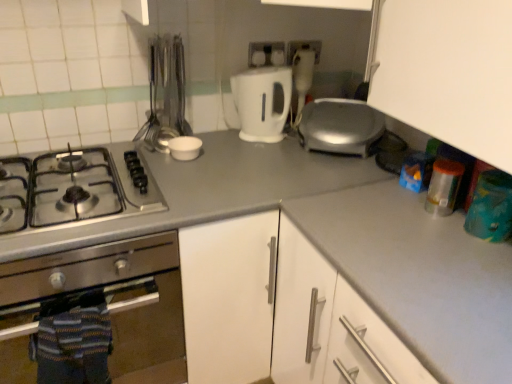
What do you see at coordinates (266, 54) in the screenshot? I see `white plastic electric outlet at upper center, the 1th electric outlet from the left` at bounding box center [266, 54].

You are a GUI agent. You are given a task and a screenshot of the screen. Output one action in this format:
    pyautogui.click(x=<x>, y=<y>)
    Task: Click on the white plastic electric outlet at upper center, which is counted as the second electric outlet, starting from the left
    The height and width of the screenshot is (384, 512).
    Given the screenshot: What is the action you would take?
    pyautogui.click(x=304, y=49)

The width and height of the screenshot is (512, 384). In order to click on stainless steel gas stove at left in this screenshot , I will do `click(87, 188)`.

This screenshot has width=512, height=384. Describe the element at coordinates (419, 276) in the screenshot. I see `white matte counter top at center` at that location.

Measure the distance between white glossy electric kettle at center, acting as the 2th kitchen appliance starting from the bottom, and camera.

white glossy electric kettle at center, acting as the 2th kitchen appliance starting from the bottom, and camera are 4.94 feet apart.

Measure the distance between stainless steel oven at left, which is counted as the second kitchen appliance, starting from the right, and camera.

stainless steel oven at left, which is counted as the second kitchen appliance, starting from the right, is 39.00 inches from camera.

In order to click on stainless steel oven at left, which ranks as the 1th kitchen appliance in bottom-to-top order in this screenshot , I will do `click(94, 314)`.

Locate an element on the screen. white matte bowl at center is located at coordinates point(185,147).

Is white plastic electric outlet at upper center, positioned as the second electric outlet in right-to-left order, far from stainless steel oven at left, marked as the first kitchen appliance in a left-to-right arrangement?

No.

Is white plastic electric outlet at upper center, positioned as the second electric outlet in right-to-left order, not within stainless steel oven at left, which is counted as the second kitchen appliance, starting from the right?

Absolutely, white plastic electric outlet at upper center, positioned as the second electric outlet in right-to-left order, is external to stainless steel oven at left, which is counted as the second kitchen appliance, starting from the right.

Which object is further away from the camera taking this photo, white plastic electric outlet at upper center, positioned as the second electric outlet in right-to-left order, or stainless steel oven at left, marked as the first kitchen appliance in a left-to-right arrangement?

white plastic electric outlet at upper center, positioned as the second electric outlet in right-to-left order, is more distant.

What's the angular difference between white plastic electric outlet at upper center, positioned as the second electric outlet in right-to-left order, and stainless steel oven at left, marked as the first kitchen appliance in a left-to-right arrangement,'s facing directions?

white plastic electric outlet at upper center, positioned as the second electric outlet in right-to-left order, and stainless steel oven at left, marked as the first kitchen appliance in a left-to-right arrangement, are facing 2.35 degrees away from each other.

Who is smaller, white plastic electric outlet at upper center, the 1th electric outlet positioned from the right, or white matte bowl at center?

white plastic electric outlet at upper center, the 1th electric outlet positioned from the right.

The height and width of the screenshot is (384, 512). I want to click on electric outlet that is the 2nd one when counting upward from the white matte bowl at center (from the image's perspective), so click(304, 49).

Which object is closer to the camera, white plastic electric outlet at upper center, the 1th electric outlet positioned from the right, or white matte bowl at center?

white matte bowl at center is in front.

Can you tell me how much white plastic electric outlet at upper center, which is counted as the second electric outlet, starting from the left, and white matte bowl at center differ in facing direction?

The angular difference between white plastic electric outlet at upper center, which is counted as the second electric outlet, starting from the left, and white matte bowl at center is 0.144 degrees.

Considering the relative positions of white matte bowl at center and white plastic electric outlet at upper center, the 1th electric outlet from the left, in the image provided, is white matte bowl at center in front of white plastic electric outlet at upper center, the 1th electric outlet from the left,?

Yes, white matte bowl at center is closer to the camera.

Can you see white matte bowl at center touching white plastic electric outlet at upper center, positioned as the second electric outlet in right-to-left order?

No, white matte bowl at center is not beside white plastic electric outlet at upper center, positioned as the second electric outlet in right-to-left order.

Which is closer to the camera, (194, 144) or (268, 46)?

Point (194, 144) is positioned closer to the camera compared to point (268, 46).

From the picture: Which of these two, white matte counter top at center or white glossy electric kettle at center, acting as the 1th kitchen appliance starting from the top, is smaller?

Smaller between the two is white glossy electric kettle at center, acting as the 1th kitchen appliance starting from the top.

From the image's perspective, would you say white matte counter top at center is shown under white glossy electric kettle at center, which is the first kitchen appliance in right-to-left order?

Yes, from the image's perspective, white matte counter top at center is below white glossy electric kettle at center, which is the first kitchen appliance in right-to-left order.

Which object is further away from the camera, white matte counter top at center or white glossy electric kettle at center, which is the first kitchen appliance in right-to-left order?

white glossy electric kettle at center, which is the first kitchen appliance in right-to-left order, is behind.

Is white glossy electric kettle at center, acting as the 2th kitchen appliance starting from the bottom, completely or partially inside gray matte countertop at center?

No, white glossy electric kettle at center, acting as the 2th kitchen appliance starting from the bottom, is not a part of gray matte countertop at center.

Which of these two, gray matte countertop at center or white glossy electric kettle at center, acting as the 1th kitchen appliance starting from the top, is thinner?

white glossy electric kettle at center, acting as the 1th kitchen appliance starting from the top.

Considering the relative sizes of gray matte countertop at center and white glossy electric kettle at center, acting as the 1th kitchen appliance starting from the top, in the image provided, is gray matte countertop at center shorter than white glossy electric kettle at center, acting as the 1th kitchen appliance starting from the top,?

In fact, gray matte countertop at center may be taller than white glossy electric kettle at center, acting as the 1th kitchen appliance starting from the top.

From a real-world perspective, is white matte bowl at center above or below stainless steel gas stove at left?

white matte bowl at center is situated higher than stainless steel gas stove at left in the real world.

Considering the points (179, 148) and (146, 211), which point is behind, point (179, 148) or point (146, 211)?

The point (179, 148) is more distant.

Does white matte bowl at center appear on the left side of stainless steel gas stove at left?

No, white matte bowl at center is not to the left of stainless steel gas stove at left.

Choose the correct answer: Is white matte bowl at center inside stainless steel gas stove at left or outside it?

white matte bowl at center is outside stainless steel gas stove at left.

From a real-world perspective, is stainless steel gas stove at left under stainless steel oven at left, which is counted as the second kitchen appliance, starting from the right?

No, from a real-world perspective, stainless steel gas stove at left is not below stainless steel oven at left, which is counted as the second kitchen appliance, starting from the right.

What's the angular difference between stainless steel gas stove at left and stainless steel oven at left, marked as the first kitchen appliance in a left-to-right arrangement,'s facing directions?

stainless steel gas stove at left and stainless steel oven at left, marked as the first kitchen appliance in a left-to-right arrangement, are facing 0.225 degrees away from each other.

Between stainless steel gas stove at left and stainless steel oven at left, which ranks as the 1th kitchen appliance in bottom-to-top order, which one has less height?

With less height is stainless steel gas stove at left.

Considering the relative positions of stainless steel gas stove at left and stainless steel oven at left, which ranks as the 1th kitchen appliance in bottom-to-top order, in the image provided, is stainless steel gas stove at left to the left or to the right of stainless steel oven at left, which ranks as the 1th kitchen appliance in bottom-to-top order,?

stainless steel gas stove at left is positioned on stainless steel oven at left, which ranks as the 1th kitchen appliance in bottom-to-top order,'s right side.

From the image's perspective, count 1st electric outlets upward from the stainless steel oven at left, marked as the first kitchen appliance in a left-to-right arrangement, and point to it. Please provide its 2D coordinates.

[(266, 54)]

The image size is (512, 384). In order to click on appliance in front of the white plastic electric outlet at upper center, the 1th electric outlet positioned from the right in this screenshot , I will do `click(185, 147)`.

When comparing their distances from white matte bowl at center, does metallic utensils at upper left or white plastic electric outlet at upper center, the 1th electric outlet positioned from the right, seem closer?

The object closer to white matte bowl at center is metallic utensils at upper left.

Looking at the image, which one is located closer to white matte bowl at center, metallic utensils at upper left or white glossy electric kettle at center, the second kitchen appliance viewed from the left?

metallic utensils at upper left is closer to white matte bowl at center.

Looking at the image, which one is located closer to white plastic electric outlet at upper center, which is counted as the second electric outlet, starting from the left, stainless steel gas stove at left or metallic utensils at upper left?

Based on the image, metallic utensils at upper left appears to be nearer to white plastic electric outlet at upper center, which is counted as the second electric outlet, starting from the left.

Based on their spatial positions, is stainless steel oven at left, which is the 2th kitchen appliance from top to bottom, or white glossy electric kettle at center, acting as the 1th kitchen appliance starting from the top, closer to white matte bowl at center?

white glossy electric kettle at center, acting as the 1th kitchen appliance starting from the top, is closer to white matte bowl at center.

Considering their positions, is white plastic electric outlet at upper center, which is counted as the second electric outlet, starting from the left, positioned further to stainless steel oven at left, marked as the first kitchen appliance in a left-to-right arrangement, than white plastic electric outlet at upper center, the 1th electric outlet from the left?

white plastic electric outlet at upper center, which is counted as the second electric outlet, starting from the left.

Which object lies further to the anchor point metallic utensils at upper left, white plastic electric outlet at upper center, which is counted as the second electric outlet, starting from the left, or gray matte countertop at center?

Based on the image, white plastic electric outlet at upper center, which is counted as the second electric outlet, starting from the left, appears to be further to metallic utensils at upper left.

Which object lies nearer to the anchor point gray matte countertop at center, stainless steel oven at left, marked as the first kitchen appliance in a left-to-right arrangement, or stainless steel gas stove at left?

Among the two, stainless steel gas stove at left is located nearer to gray matte countertop at center.

From the image, which object appears to be farther from white plastic electric outlet at upper center, positioned as the second electric outlet in right-to-left order, gray matte countertop at center or white matte bowl at center?

Among the two, gray matte countertop at center is located further to white plastic electric outlet at upper center, positioned as the second electric outlet in right-to-left order.

Identify the location of kitchen appliance between stainless steel gas stove at left and gray matte countertop at center. (262, 102).

At what (x,y) coordinates should I click in order to perform the action: click on silverware between white plastic electric outlet at upper center, positioned as the second electric outlet in right-to-left order, and gray matte countertop at center from top to bottom. Please return your answer as a coordinate pair (x, y). Looking at the image, I should click on (165, 94).

Where is `silverware between stainless steel gas stove at left and white glossy electric kettle at center, acting as the 1th kitchen appliance starting from the top, in the horizontal direction`? silverware between stainless steel gas stove at left and white glossy electric kettle at center, acting as the 1th kitchen appliance starting from the top, in the horizontal direction is located at coordinates tap(165, 94).

Locate an element on the screen. The image size is (512, 384). appliance between metallic utensils at upper left and white glossy electric kettle at center, which is the first kitchen appliance in right-to-left order, from left to right is located at coordinates (185, 147).